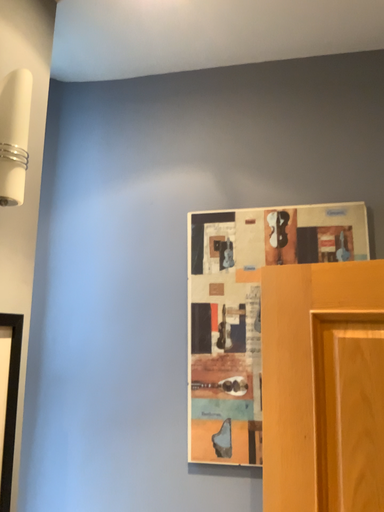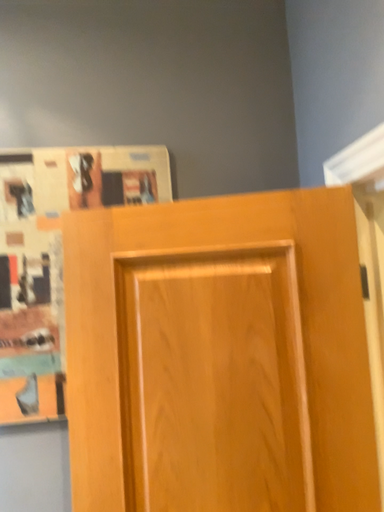
Question: Which way did the camera rotate in the video?

Choices:
 (A) rotated left
 (B) rotated right

Answer: (B)